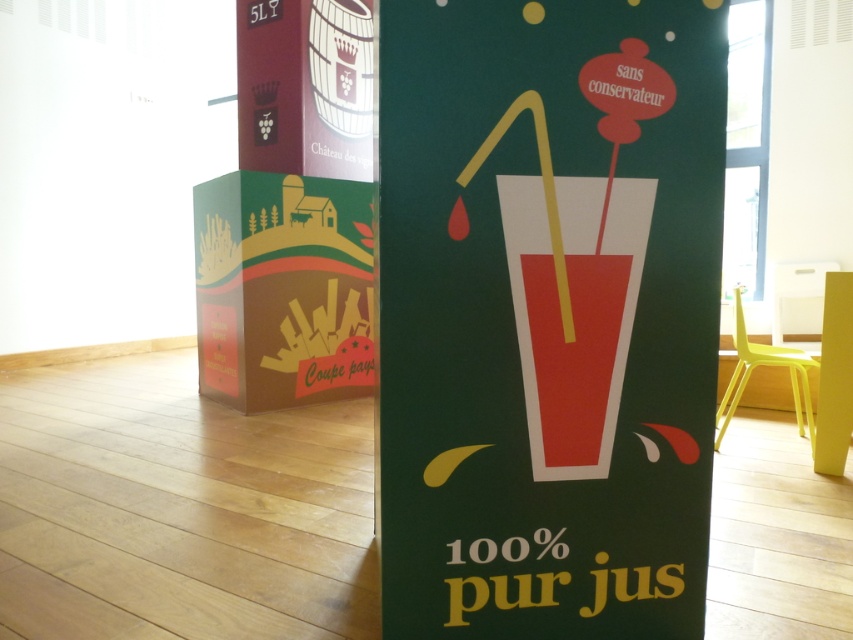
Question: Among these points, which one is nearest to the camera?

Choices:
 (A) (666, 529)
 (B) (596, 449)

Answer: (B)

Question: Does green paperboard sign at center appear over matte red glass at center?

Choices:
 (A) no
 (B) yes

Answer: (B)

Question: Is green paperboard sign at center bigger than matte red glass at center?

Choices:
 (A) yes
 (B) no

Answer: (A)

Question: Which object appears farthest from the camera in this image?

Choices:
 (A) green paperboard sign at center
 (B) matte red glass at center

Answer: (B)

Question: Can you confirm if green paperboard sign at center is smaller than matte red glass at center?

Choices:
 (A) yes
 (B) no

Answer: (B)

Question: Which of the following is the farthest from the observer?

Choices:
 (A) matte red glass at center
 (B) green paperboard sign at center

Answer: (A)